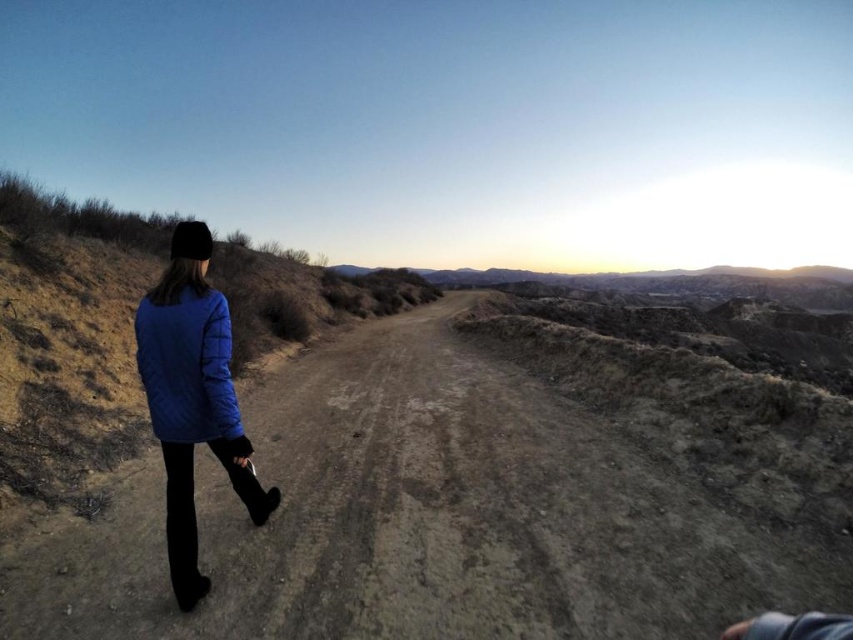
Is point (189, 518) in front of point (225, 412)?

That is True.

Which is in front, point (225, 301) or point (218, 349)?

Point (218, 349) is more forward.

Is point (183, 250) farther from viewer compared to point (202, 426)?

Yes, point (183, 250) is farther from viewer.

What are the coordinates of `blue quilted jacket at lower left` in the screenshot? It's located at (192, 397).

Does dull brown dirt track at center have a lesser width compared to matte blue jacket at lower left?

Incorrect, dull brown dirt track at center's width is not less than matte blue jacket at lower left's.

Does dull brown dirt track at center appear on the left side of matte blue jacket at lower left?

In fact, dull brown dirt track at center is to the right of matte blue jacket at lower left.

Measure the distance between point (x=456, y=356) and camera.

Point (x=456, y=356) is 336.61 meters away from camera.

At what (x,y) coordinates should I click in order to perform the action: click on dull brown dirt track at center. Please return your answer as a coordinate pair (x, y). The width and height of the screenshot is (853, 640). Looking at the image, I should click on click(425, 518).

Consider the image. Does dull brown dirt track at center appear under blue quilted jacket at lower left?

Indeed, dull brown dirt track at center is positioned under blue quilted jacket at lower left.

In the scene shown: Is the position of dull brown dirt track at center more distant than that of blue quilted jacket at lower left?

No, it is in front of blue quilted jacket at lower left.

Find the location of a particular element. dull brown dirt track at center is located at coordinates (425, 518).